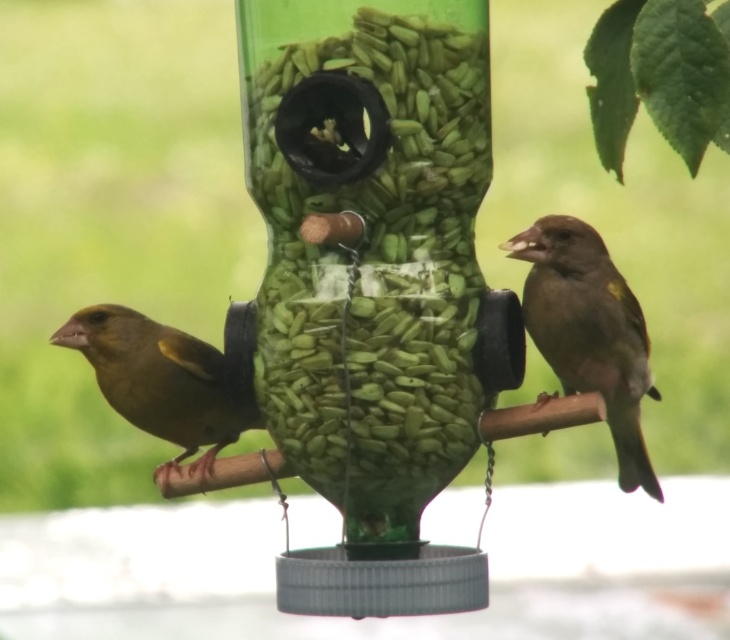
Question: Is brown matte sparrow at right wider than green matte bird at left?

Choices:
 (A) no
 (B) yes

Answer: (A)

Question: Which object appears closest to the camera in this image?

Choices:
 (A) green matte bird at left
 (B) brown matte sparrow at right

Answer: (B)

Question: Which object is farther from the camera taking this photo?

Choices:
 (A) brown matte sparrow at right
 (B) green plastic bird feeder at center

Answer: (A)

Question: In this image, where is green plastic bird feeder at center located relative to green matte bird at left?

Choices:
 (A) above
 (B) below

Answer: (A)

Question: Based on their relative distances, which object is nearer to the green matte bird at left?

Choices:
 (A) brown matte sparrow at right
 (B) green plastic bird feeder at center

Answer: (B)

Question: Can you confirm if brown matte sparrow at right is positioned above green matte bird at left?

Choices:
 (A) no
 (B) yes

Answer: (B)